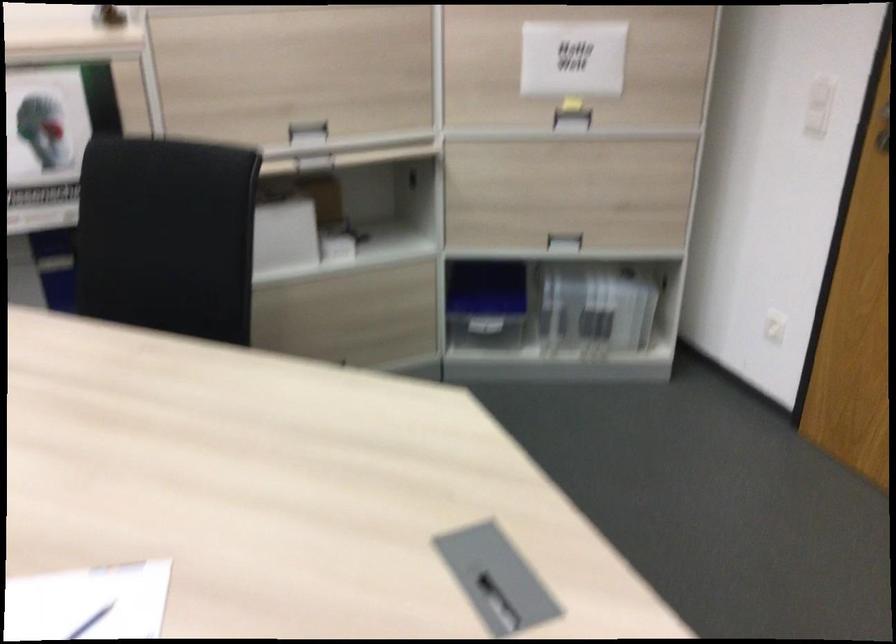
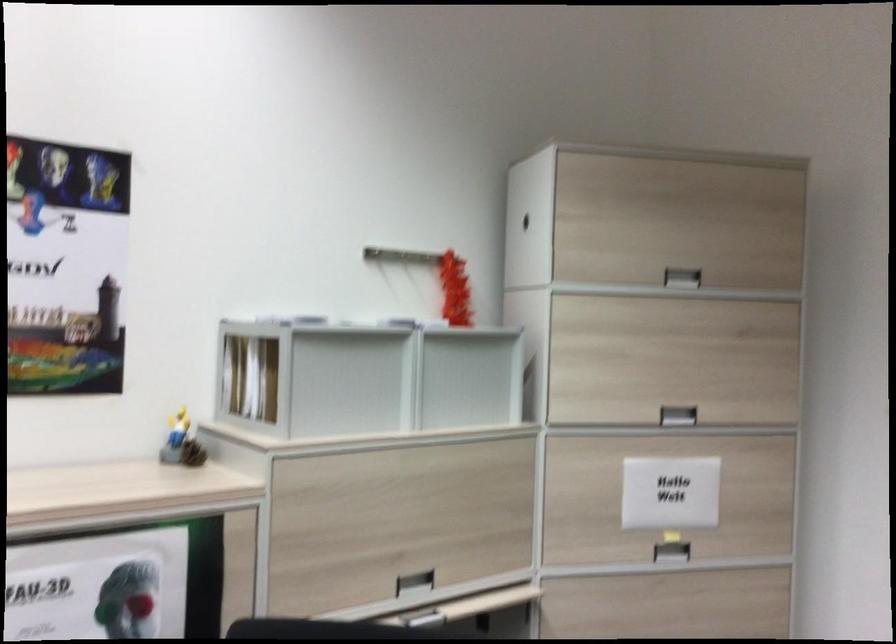
Where in the second image is the point corresponding to point 565,120 from the first image?

(670, 552)